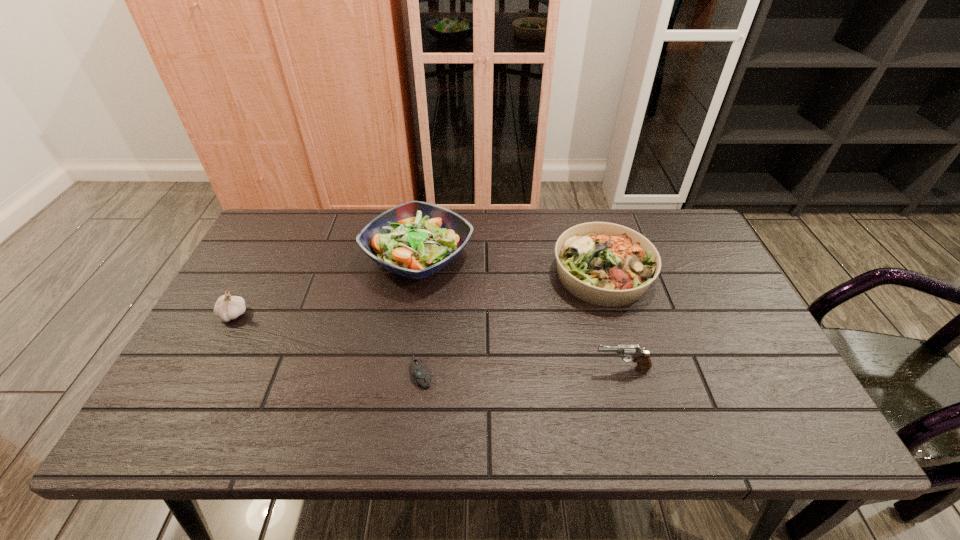
The height and width of the screenshot is (540, 960). Identify the location of object that is the closest to the left salad plate. (x=420, y=374).